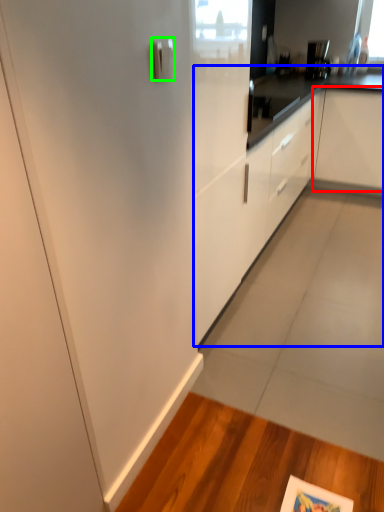
Question: Based on their relative distances, which object is farther from cabinetry (highlighted by a red box)? Choose from cabinetry (highlighted by a blue box) and door handle (highlighted by a green box).

Choices:
 (A) cabinetry
 (B) door handle

Answer: (B)